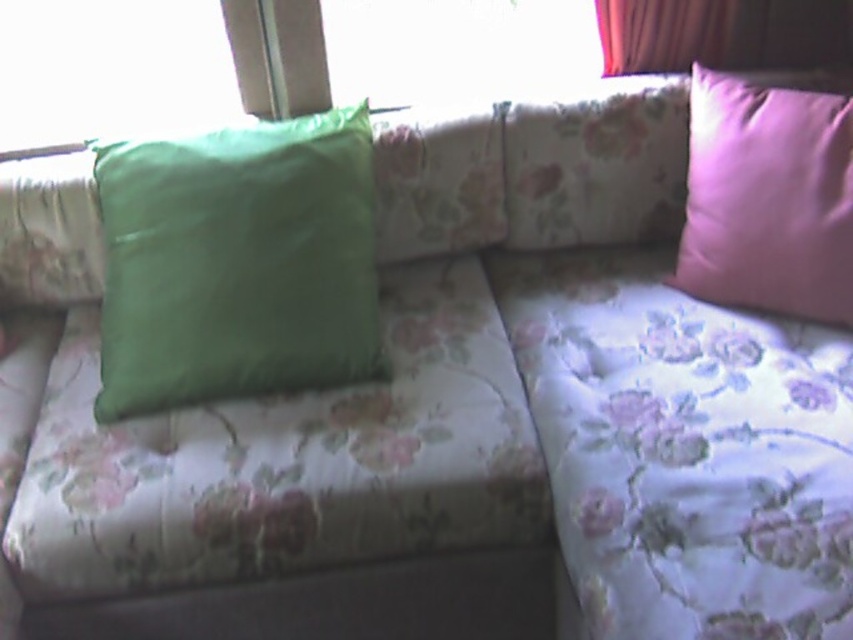
You are standing in front of the sofa and want to reach the pink satin pillow at right. If your arm can extend 4 feet, can you reach it?

The pink satin pillow at right is 4.54 feet from camera, so your arm can only extend 4 feet. Therefore, you cannot reach it.

You are standing in front of the sofa and want to place a book on the green matte pillow at left. Based on its position, can you determine if the pillow is on the left side of the sofa?

The green matte pillow at left is located at point (236, 262), which indicates it is positioned on the left side of the sofa.